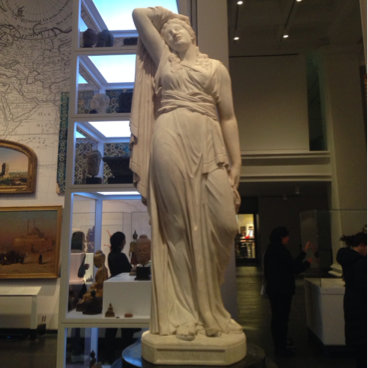
Find the location of a particular element. The height and width of the screenshot is (368, 368). portrait is located at coordinates (21, 160).